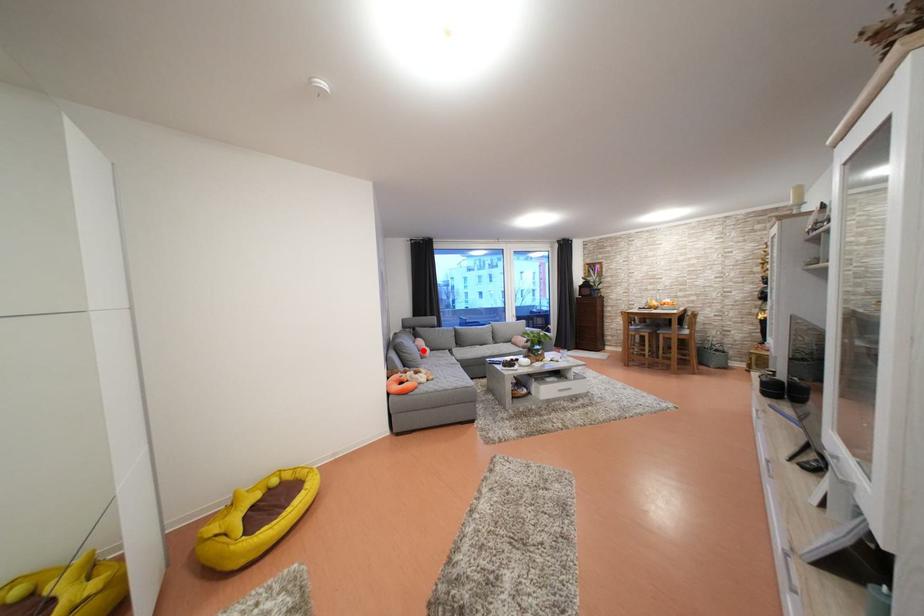
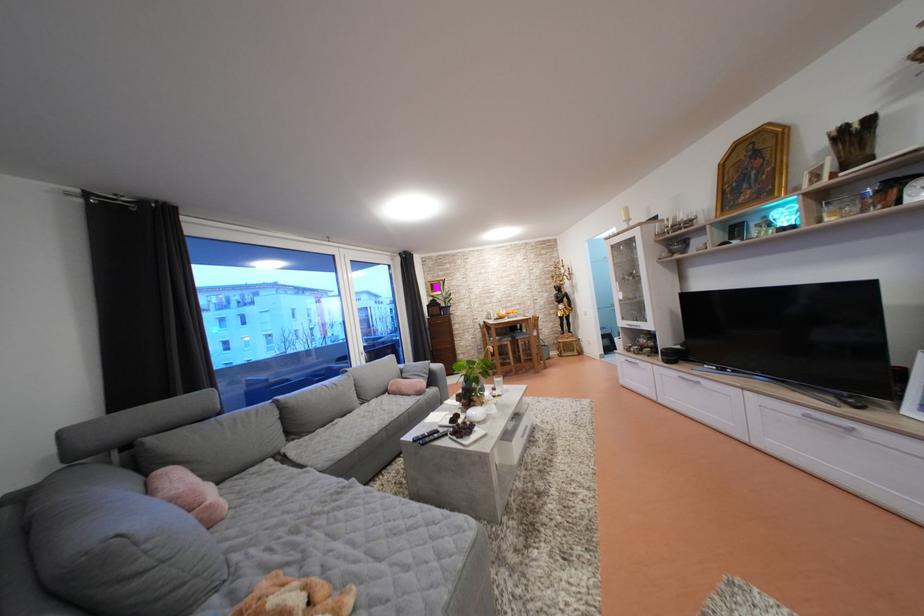
Find the pixel in the second image that matches the highlighted location in the first image.

(180, 505)